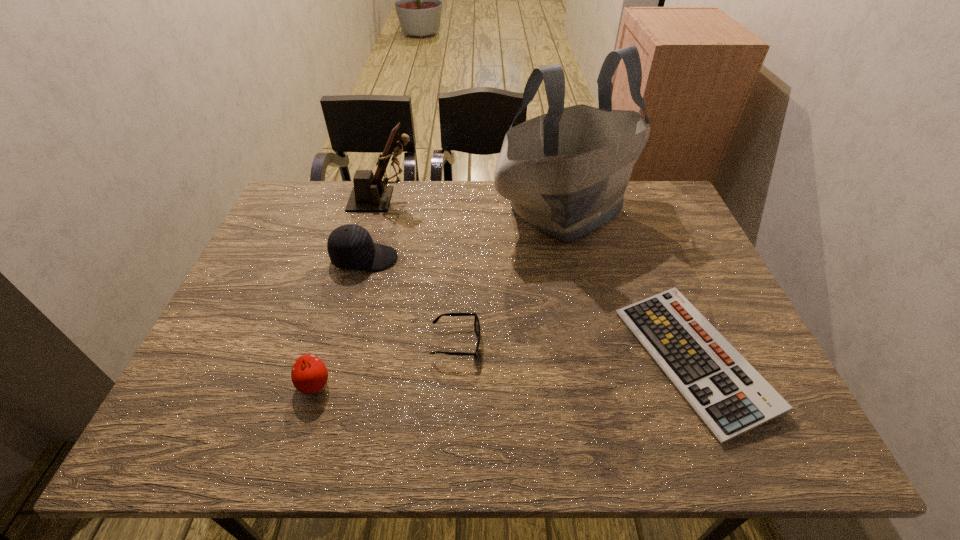
I want to click on shopping bag, so pyautogui.click(x=565, y=172).

Where is `figurine`? figurine is located at coordinates tap(369, 194).

Where is `baseball cap`? baseball cap is located at coordinates (350, 247).

Identify the location of apple. This screenshot has width=960, height=540. (309, 374).

You are a GUI agent. You are given a task and a screenshot of the screen. Output one action in this format:
    pyautogui.click(x=<x>, y=<y>)
    Task: Click on the fifth tallest object
    This screenshot has height=540, width=960.
    Given the screenshot: What is the action you would take?
    pyautogui.click(x=476, y=322)

Where is `sunglasses`? The image size is (960, 540). sunglasses is located at coordinates (476, 322).

Find the location of a particular element. computer keyboard is located at coordinates (727, 393).

Identify the location of vacant region located on the right of the shopping bag. (663, 210).

Where is `free location located 0.110m on the front-facing side of the figurine`? free location located 0.110m on the front-facing side of the figurine is located at coordinates (450, 199).

What are the coordinates of `free location located at the front of the baseball cap where the brim is located` in the screenshot? It's located at (419, 258).